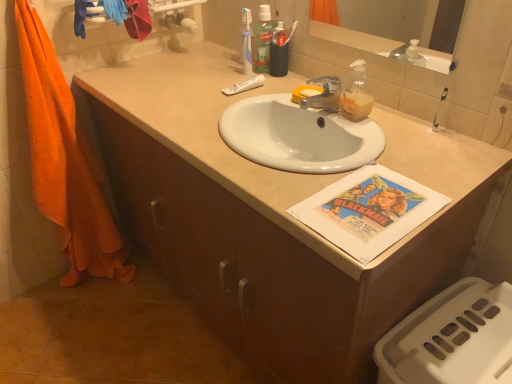
The height and width of the screenshot is (384, 512). Find the location of `free region on the left part of orange cotton towel at left`. free region on the left part of orange cotton towel at left is located at coordinates (32, 299).